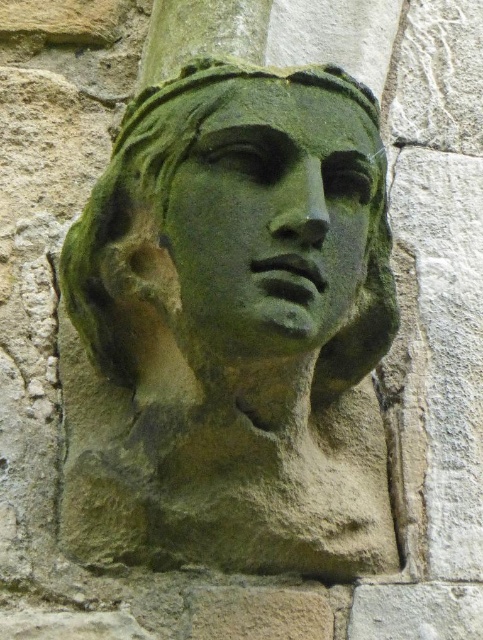
Who is lower down, green stone bust at center or green stone face at center?

green stone bust at center

Does point (144, 330) come farther from viewer compared to point (194, 250)?

Yes.

At what (x,y) coordinates should I click in order to perform the action: click on green stone bust at center. Please return your answer as a coordinate pair (x, y). This screenshot has width=483, height=640. Looking at the image, I should click on (231, 330).